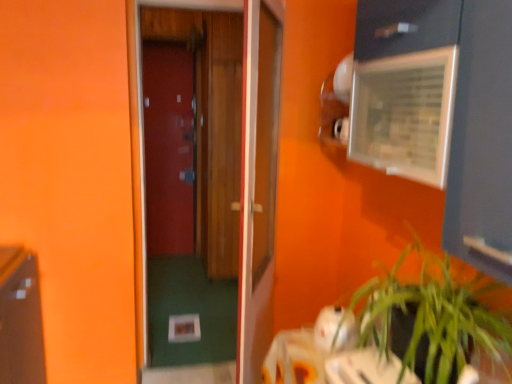
What do you see at coordinates (168, 148) in the screenshot?
I see `matte wood door at center, which is counted as the 3th door, starting from the front` at bounding box center [168, 148].

Describe the element at coordinates (404, 114) in the screenshot. This screenshot has width=512, height=384. I see `clear plastic medicine cabinet at upper right` at that location.

In order to click on wooden door at center, which is counted as the 1th door, starting from the right in this screenshot , I will do `click(258, 182)`.

The width and height of the screenshot is (512, 384). What are the coordinates of `wooden door at center, positioned as the 2th door in front-to-back order` in the screenshot? It's located at (222, 197).

Identify the location of the 3rd door to the left of the clear plastic medicine cabinet at upper right, starting your count from the anchor. The image size is (512, 384). (168, 148).

Which of these two, clear plastic medicine cabinet at upper right or matte wood door at center, the 1th door when ordered from back to front, is wider?

clear plastic medicine cabinet at upper right is wider.

From a real-world perspective, between clear plastic medicine cabinet at upper right and matte wood door at center, which is counted as the 3th door, starting from the front, who is vertically lower?

matte wood door at center, which is counted as the 3th door, starting from the front.

Does point (383, 72) come behind point (181, 191)?

No, (383, 72) is in front of (181, 191).

Does point (144, 50) come closer to viewer compared to point (273, 70)?

No, (144, 50) is further to viewer.

Between matte wood door at center, arranged as the third door when viewed from the right, and wooden door at center, which is the second door in right-to-left order, which one has less height?

wooden door at center, which is the second door in right-to-left order.

Which of these two, matte wood door at center, which is counted as the 3th door, starting from the front, or wooden door at center, positioned as the 2th door in front-to-back order, is thinner?

Thinner between the two is matte wood door at center, which is counted as the 3th door, starting from the front.

Is clear plastic medicine cabinet at upper right inside or outside of wooden door at center, which is counted as the second door, starting from the left?

clear plastic medicine cabinet at upper right lies outside wooden door at center, which is counted as the second door, starting from the left.

Is clear plastic medicine cabinet at upper right next to wooden door at center, which is the second door in right-to-left order?

No, clear plastic medicine cabinet at upper right is not making contact with wooden door at center, which is the second door in right-to-left order.

Does point (389, 68) lie in front of point (180, 35)?

Yes, point (389, 68) is in front of point (180, 35).

Between clear plastic medicine cabinet at upper right and wooden door at center, which is counted as the second door, starting from the left, which one appears on the left side from the viewer's perspective?

wooden door at center, which is counted as the second door, starting from the left, is more to the left.

Is the depth of wooden door at center, which is the 3th door in back-to-front order, greater than that of wooden door at center, positioned as the 2th door in front-to-back order?

No, the depth of wooden door at center, which is the 3th door in back-to-front order, is less than that of wooden door at center, positioned as the 2th door in front-to-back order.

In the image, is wooden door at center, which is the 3th door in back-to-front order, on the left side or the right side of wooden door at center, positioned as the 2th door in front-to-back order?

Clearly, wooden door at center, which is the 3th door in back-to-front order, is on the right of wooden door at center, positioned as the 2th door in front-to-back order, in the image.

From a real-world perspective, starting from the wooden door at center, which is the 3th door in back-to-front order, which door is the 2nd one vertically above it? Please provide its 2D coordinates.

[(222, 197)]

Is wooden door at center, the second door viewed from the back, placed right next to wooden door at center, which is counted as the 1th door, starting from the right?

No, wooden door at center, the second door viewed from the back, is not making contact with wooden door at center, which is counted as the 1th door, starting from the right.

Considering the sizes of objects wooden door at center, which is the second door in right-to-left order, and wooden door at center, which is the 3th door in back-to-front order, in the image provided, who is wider, wooden door at center, which is the second door in right-to-left order, or wooden door at center, which is the 3th door in back-to-front order,?

wooden door at center, which is the 3th door in back-to-front order, is wider.

Considering the positions of objects wooden door at center, positioned as the 2th door in front-to-back order, and wooden door at center, which is the 3th door in back-to-front order, in the image provided, who is more to the left, wooden door at center, positioned as the 2th door in front-to-back order, or wooden door at center, which is the 3th door in back-to-front order,?

From the viewer's perspective, wooden door at center, positioned as the 2th door in front-to-back order, appears more on the left side.

Does green leafy plant at lower right touch wooden door at center, which is counted as the 1th door, starting from the right?

green leafy plant at lower right is not next to wooden door at center, which is counted as the 1th door, starting from the right, and they're not touching.

Between green leafy plant at lower right and wooden door at center, acting as the 1th door starting from the front, which one has smaller width?

wooden door at center, acting as the 1th door starting from the front.

Which of these two, green leafy plant at lower right or wooden door at center, acting as the 1th door starting from the front, is smaller?

green leafy plant at lower right.

From a real-world perspective, is green leafy plant at lower right positioned above or below wooden door at center, which is the 3th door in back-to-front order?

In terms of real-world spatial position, green leafy plant at lower right is below wooden door at center, which is the 3th door in back-to-front order.

Could you tell me if wooden door at center, which is the 3th door in back-to-front order, is facing green leafy plant at lower right?

No.

Identify the location of door that is the 1st object to the left of the green leafy plant at lower right, starting at the anchor. The image size is (512, 384). (258, 182).

Does point (271, 117) come farther from viewer compared to point (429, 252)?

Yes, it is.

Consider the image. Is wooden door at center, which appears as the third door when viewed from the left, surrounding green leafy plant at lower right?

No, green leafy plant at lower right is located outside of wooden door at center, which appears as the third door when viewed from the left.

You are a GUI agent. You are given a task and a screenshot of the screen. Output one action in this format:
    pyautogui.click(x=<x>, y=<y>)
    Task: Click on the door that is the 3rd one when counting backward from the clear plastic medicine cabinet at upper right
    This screenshot has height=384, width=512.
    Given the screenshot: What is the action you would take?
    pyautogui.click(x=168, y=148)

The width and height of the screenshot is (512, 384). In order to click on the 1st door located beneath the wooden door at center, positioned as the 2th door in front-to-back order (from a real-world perspective) in this screenshot , I will do `click(168, 148)`.

Looking at the image, which one is located closer to green leafy plant at lower right, clear plastic medicine cabinet at upper right or wooden door at center, which is the second door in right-to-left order?

Among the two, clear plastic medicine cabinet at upper right is located nearer to green leafy plant at lower right.

Looking at the image, which one is located closer to wooden door at center, which appears as the third door when viewed from the left, green leafy plant at lower right or clear plastic medicine cabinet at upper right?

clear plastic medicine cabinet at upper right lies closer to wooden door at center, which appears as the third door when viewed from the left, than the other object.

From the image, which object appears to be farther from green leafy plant at lower right, matte wood door at center, the 1th door when ordered from back to front, or wooden door at center, which appears as the third door when viewed from the left?

The object further to green leafy plant at lower right is matte wood door at center, the 1th door when ordered from back to front.

When comparing their distances from wooden door at center, which is the 3th door in back-to-front order, does green leafy plant at lower right or matte wood door at center, which is counted as the 3th door, starting from the front, seem further?

The object further to wooden door at center, which is the 3th door in back-to-front order, is matte wood door at center, which is counted as the 3th door, starting from the front.

Considering their positions, is green leafy plant at lower right positioned closer to matte wood door at center, arranged as the third door when viewed from the right, than wooden door at center, which is the second door in right-to-left order?

wooden door at center, which is the second door in right-to-left order, is positioned closer to the anchor matte wood door at center, arranged as the third door when viewed from the right.

Considering their positions, is wooden door at center, positioned as the 2th door in front-to-back order, positioned further to matte wood door at center, the 1th door when ordered from back to front, than green leafy plant at lower right?

The object further to matte wood door at center, the 1th door when ordered from back to front, is green leafy plant at lower right.

From the image, which object appears to be nearer to wooden door at center, which appears as the third door when viewed from the left, matte wood door at center, which is the 1th door from left to right, or green leafy plant at lower right?

green leafy plant at lower right is closer to wooden door at center, which appears as the third door when viewed from the left.

Estimate the real-world distances between objects in this image. Which object is closer to wooden door at center, which is the 3th door in back-to-front order, clear plastic medicine cabinet at upper right or matte wood door at center, arranged as the third door when viewed from the right?

Answer: clear plastic medicine cabinet at upper right.

The height and width of the screenshot is (384, 512). What are the coordinates of `medicine cabinet between green leafy plant at lower right and wooden door at center, the second door viewed from the back, in the front-back direction` in the screenshot? It's located at (404, 114).

Where is `door located between green leafy plant at lower right and wooden door at center, which is the second door in right-to-left order, in the depth direction`? This screenshot has width=512, height=384. door located between green leafy plant at lower right and wooden door at center, which is the second door in right-to-left order, in the depth direction is located at coordinates (258, 182).

The width and height of the screenshot is (512, 384). I want to click on medicine cabinet located between green leafy plant at lower right and matte wood door at center, arranged as the third door when viewed from the right, in the depth direction, so click(404, 114).

Image resolution: width=512 pixels, height=384 pixels. In order to click on door between clear plastic medicine cabinet at upper right and wooden door at center, the second door viewed from the back, along the z-axis in this screenshot , I will do `click(258, 182)`.